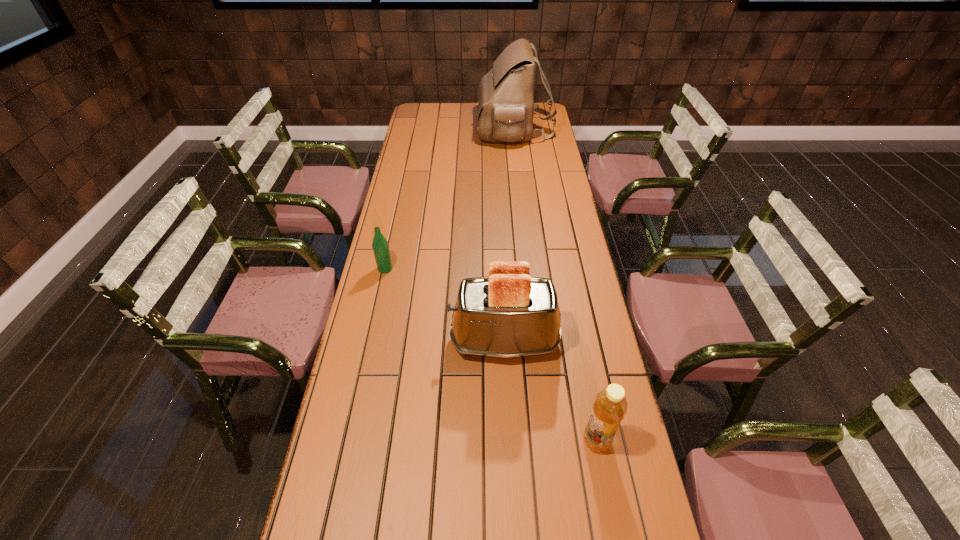
Identify the location of bottle present at the right edge. (610, 405).

You are a GUI agent. You are given a task and a screenshot of the screen. Output one action in this format:
    pyautogui.click(x=<x>, y=<y>)
    Task: Click on the object that is at the far right corner
    The width and height of the screenshot is (960, 540).
    Given the screenshot: What is the action you would take?
    pyautogui.click(x=505, y=105)

I want to click on vacant space at the left edge of the desktop, so click(x=372, y=368).

In the image, there is a desktop. Where is `vacant area at the right edge`? vacant area at the right edge is located at coordinates (555, 259).

In order to click on vacant space at the far left corner in this screenshot , I will do `click(443, 103)`.

You are a GUI agent. You are given a task and a screenshot of the screen. Output one action in this format:
    pyautogui.click(x=<x>, y=<y>)
    Task: Click on the vacant region between the third shortest object and the shortest object
    The width and height of the screenshot is (960, 540).
    Given the screenshot: What is the action you would take?
    pyautogui.click(x=444, y=305)

Where is `empty space that is in between the satchel and the second tallest object`? The image size is (960, 540). empty space that is in between the satchel and the second tallest object is located at coordinates (509, 235).

At what (x,y) coordinates should I click in order to perform the action: click on free space between the second shortest object and the farthest object. Please return your answer as a coordinate pair (x, y). Looking at the image, I should click on [555, 285].

The image size is (960, 540). Identify the location of free space between the toaster and the nearest object. (550, 391).

Image resolution: width=960 pixels, height=540 pixels. Identify the location of vacant area between the second tallest object and the third nearest object. (444, 305).